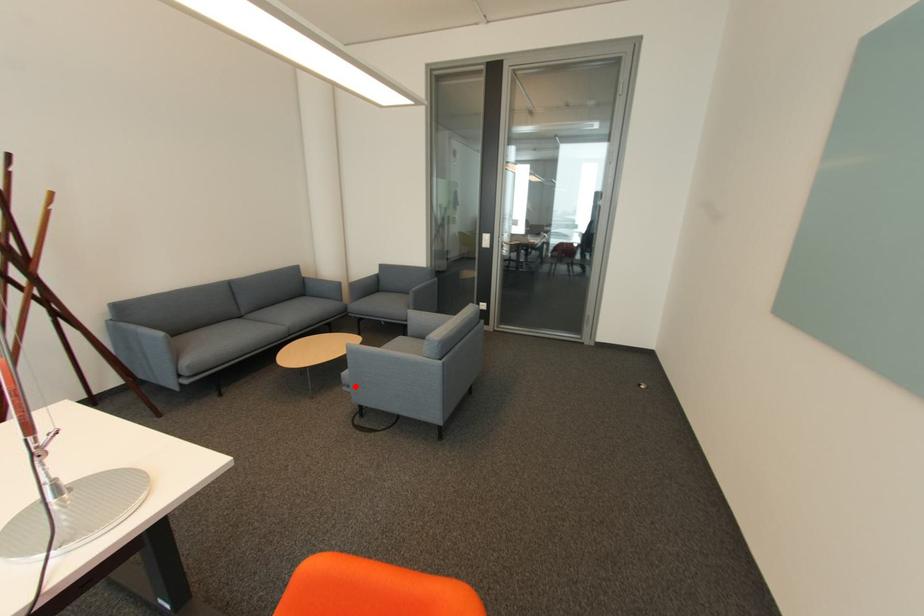
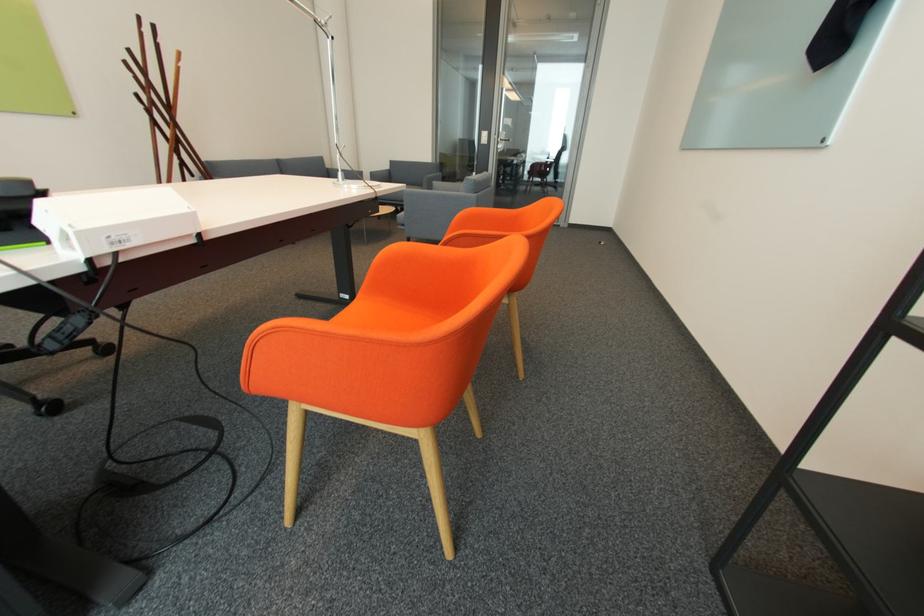
Question: I am providing you with two images of the same scene from different viewpoints. In image1, a red point is highlighted. Considering the same 3D point in image2, which of the following is correct?

Choices:
 (A) It is closer
 (B) It is farther

Answer: (A)